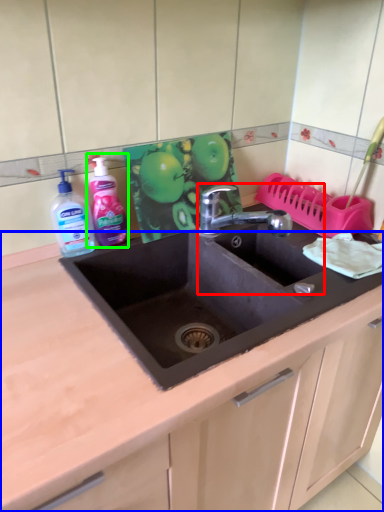
Question: Which object is the closest to the sink (highlighted by a red box)? Choose among these: countertop (highlighted by a blue box) or cleaning product (highlighted by a green box).

Choices:
 (A) countertop
 (B) cleaning product

Answer: (B)